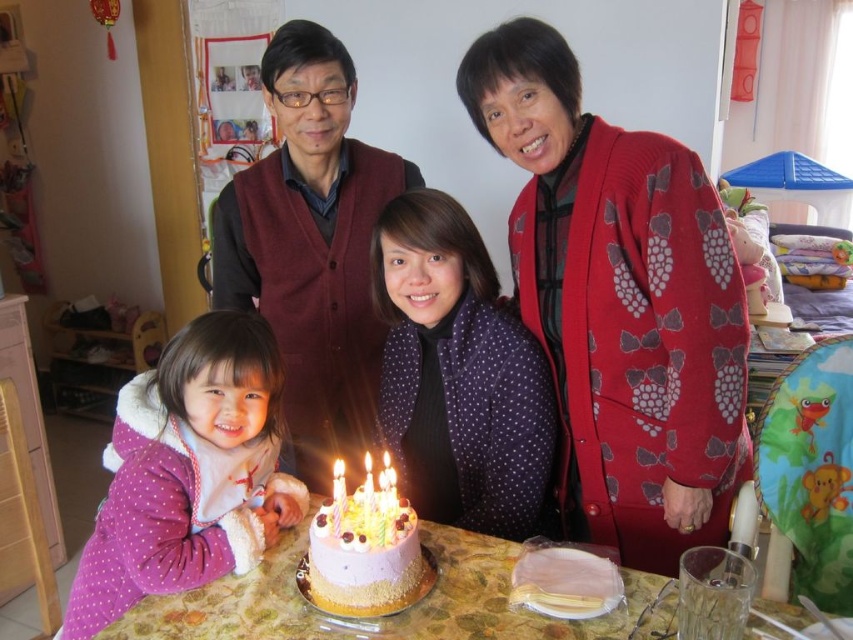
Is point (663, 262) positioned after point (606, 632)?

Yes, it is.

Between red knitwear at upper right and marble-patterned table at center, which one has more height?

With more height is red knitwear at upper right.

Locate an element on the screen. This screenshot has width=853, height=640. red knitwear at upper right is located at coordinates (619, 301).

From the picture: Is red knitwear at upper right bigger than purple fleece jacket at lower left?

Correct, red knitwear at upper right is larger in size than purple fleece jacket at lower left.

Between red knitwear at upper right and purple fleece jacket at lower left, which one is positioned higher?

Positioned higher is red knitwear at upper right.

You are a GUI agent. You are given a task and a screenshot of the screen. Output one action in this format:
    pyautogui.click(x=<x>, y=<y>)
    Task: Click on the red knitwear at upper right
    This screenshot has height=640, width=853.
    Given the screenshot: What is the action you would take?
    pyautogui.click(x=619, y=301)

Image resolution: width=853 pixels, height=640 pixels. I want to click on red knitwear at upper right, so click(x=619, y=301).

Between point (625, 518) and point (430, 442), which one is positioned in front?

Point (625, 518)

What are the coordinates of `red knitwear at upper right` in the screenshot? It's located at (619, 301).